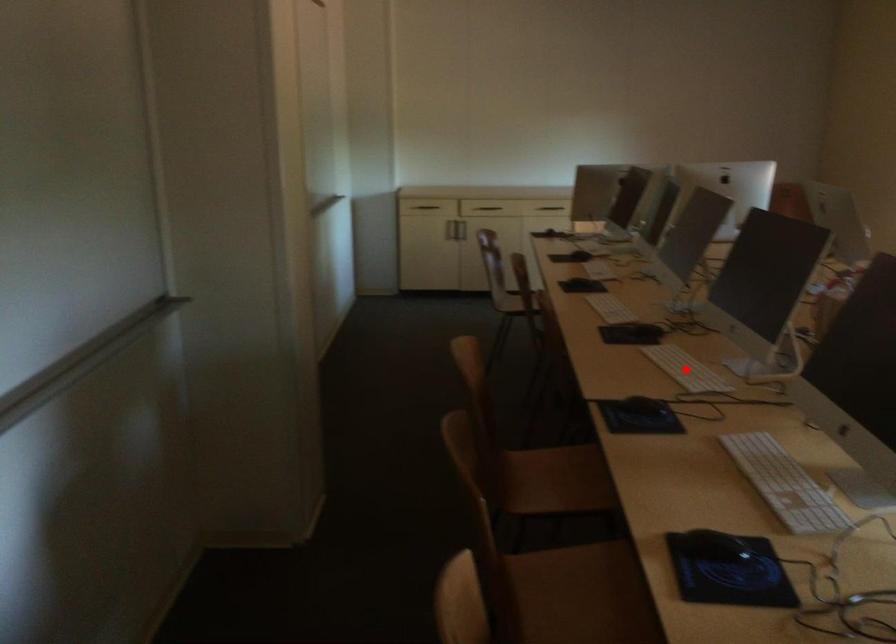
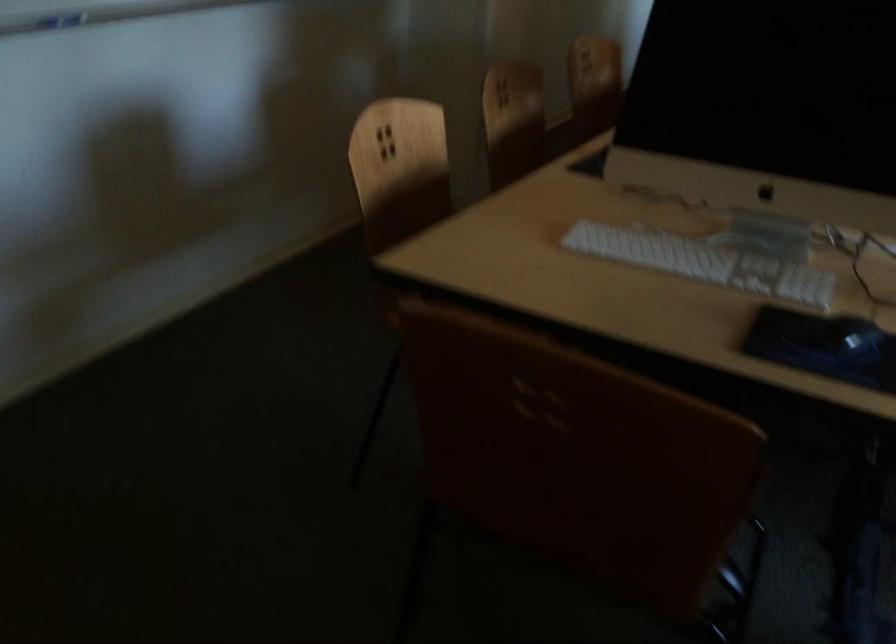
Question: I am providing you with two images of the same scene from different viewpoints. A red point is marked on the first image. Is the red point's position out of view in image 2?

Choices:
 (A) Yes
 (B) No

Answer: (A)